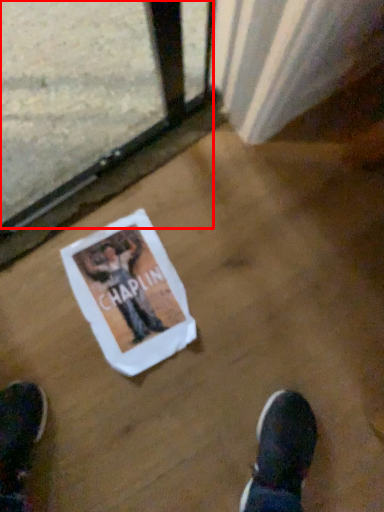
Question: From the image's perspective, considering the relative positions of train window (annotated by the red box) and flyer in the image provided, where is train window (annotated by the red box) located with respect to the staircase?

Choices:
 (A) below
 (B) above

Answer: (B)